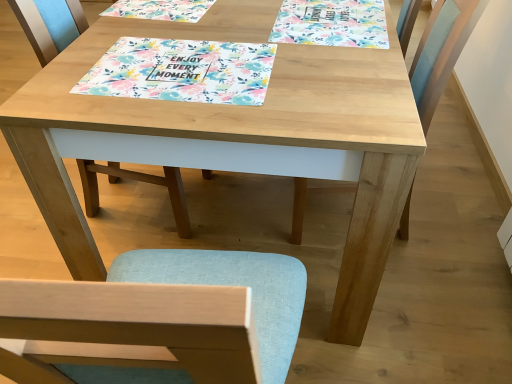
You are a GUI agent. You are given a task and a screenshot of the screen. Output one action in this format:
    pyautogui.click(x=<x>, y=<y>)
    Task: Click on the free point above floral paper placemat at upper center (from a real-world perspective)
    
    Given the screenshot: What is the action you would take?
    pyautogui.click(x=330, y=5)